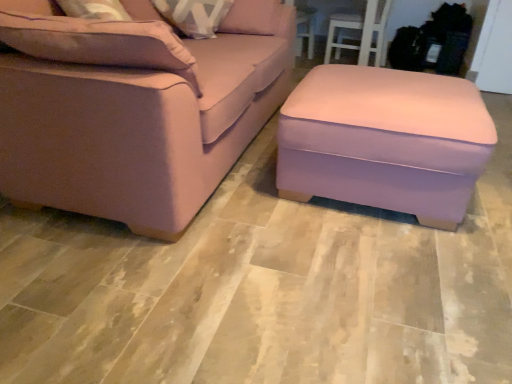
This screenshot has width=512, height=384. I want to click on purple fabric ottoman at center, so click(x=385, y=140).

Image resolution: width=512 pixels, height=384 pixels. What do you see at coordinates (385, 140) in the screenshot?
I see `purple fabric ottoman at center` at bounding box center [385, 140].

Measure the distance between point (x=394, y=129) and camera.

The depth of point (x=394, y=129) is 1.54 meters.

Measure the distance between matte pink fabric couch at center and camera.

A distance of 4.07 feet exists between matte pink fabric couch at center and camera.

Find the location of a particular element. matte pink fabric couch at center is located at coordinates (134, 108).

This screenshot has height=384, width=512. What do you see at coordinates (134, 108) in the screenshot?
I see `matte pink fabric couch at center` at bounding box center [134, 108].

Locate an element on the screen. The image size is (512, 384). purple fabric ottoman at center is located at coordinates (385, 140).

Is purple fabric ottoman at center at the left side of matte pink fabric couch at center?

In fact, purple fabric ottoman at center is to the right of matte pink fabric couch at center.

Does purple fabric ottoman at center lie in front of matte pink fabric couch at center?

That is False.

Which is less distant, (384, 102) or (218, 67)?

Point (384, 102) is positioned closer to the camera compared to point (218, 67).

From the image's perspective, is purple fabric ottoman at center on matte pink fabric couch at center?

No, from the image's perspective, purple fabric ottoman at center is not over matte pink fabric couch at center.

From a real-world perspective, which is physically above, purple fabric ottoman at center or matte pink fabric couch at center?

matte pink fabric couch at center is physically above.

Does purple fabric ottoman at center have a greater width compared to matte pink fabric couch at center?

In fact, purple fabric ottoman at center might be narrower than matte pink fabric couch at center.

In terms of height, does purple fabric ottoman at center look taller or shorter compared to matte pink fabric couch at center?

Considering their sizes, purple fabric ottoman at center has less height than matte pink fabric couch at center.

Based on their sizes in the image, would you say purple fabric ottoman at center is bigger or smaller than matte pink fabric couch at center?

Clearly, purple fabric ottoman at center is smaller in size than matte pink fabric couch at center.

Consider the image. Which is correct: purple fabric ottoman at center is inside matte pink fabric couch at center, or outside of it?

purple fabric ottoman at center is not inside matte pink fabric couch at center, it's outside.

Is purple fabric ottoman at center touching matte pink fabric couch at center?

There is a gap between purple fabric ottoman at center and matte pink fabric couch at center.

Is purple fabric ottoman at center looking in the opposite direction of matte pink fabric couch at center?

Correct, purple fabric ottoman at center is looking away from matte pink fabric couch at center.

Measure the distance between purple fabric ottoman at center and matte pink fabric couch at center.

They are 61.72 centimeters apart.

At what (x,y) coordinates should I click in order to perform the action: click on stool behind the matte pink fabric couch at center. Please return your answer as a coordinate pair (x, y). This screenshot has height=384, width=512. Looking at the image, I should click on (385, 140).

Which object is positioned more to the right, matte pink fabric couch at center or purple fabric ottoman at center?

Positioned to the right is purple fabric ottoman at center.

Which is behind, matte pink fabric couch at center or purple fabric ottoman at center?

purple fabric ottoman at center.

Is point (283, 27) in front of point (297, 91)?

No, (283, 27) is behind (297, 91).

From the image's perspective, which is above, matte pink fabric couch at center or purple fabric ottoman at center?

matte pink fabric couch at center appears higher in the image.

From a real-world perspective, is matte pink fabric couch at center located beneath purple fabric ottoman at center?

No, from a real-world perspective, matte pink fabric couch at center is not below purple fabric ottoman at center.

Does matte pink fabric couch at center have a greater width compared to purple fabric ottoman at center?

Yes, matte pink fabric couch at center is wider than purple fabric ottoman at center.

Does matte pink fabric couch at center have a greater height compared to purple fabric ottoman at center?

Correct, matte pink fabric couch at center is much taller as purple fabric ottoman at center.

Is matte pink fabric couch at center bigger than purple fabric ottoman at center?

Correct, matte pink fabric couch at center is larger in size than purple fabric ottoman at center.

Consider the image. Choose the correct answer: Is matte pink fabric couch at center inside purple fabric ottoman at center or outside it?

The correct answer is: outside.

Is matte pink fabric couch at center placed right next to purple fabric ottoman at center?

They are not placed beside each other.

Is matte pink fabric couch at center looking in the opposite direction of purple fabric ottoman at center?

matte pink fabric couch at center does not have its back to purple fabric ottoman at center.

Can you tell me how much matte pink fabric couch at center and purple fabric ottoman at center differ in facing direction?

They differ by 0.00114 degrees in their facing directions.

How far apart are matte pink fabric couch at center and purple fabric ottoman at center?

The distance of matte pink fabric couch at center from purple fabric ottoman at center is 61.72 centimeters.

Image resolution: width=512 pixels, height=384 pixels. I want to click on studio couch that appears on the left of purple fabric ottoman at center, so click(134, 108).

Identify the location of studio couch located on the left of purple fabric ottoman at center. The width and height of the screenshot is (512, 384). (134, 108).

What are the coordinates of `studio couch above the purple fabric ottoman at center (from a real-world perspective)` in the screenshot? It's located at (134, 108).